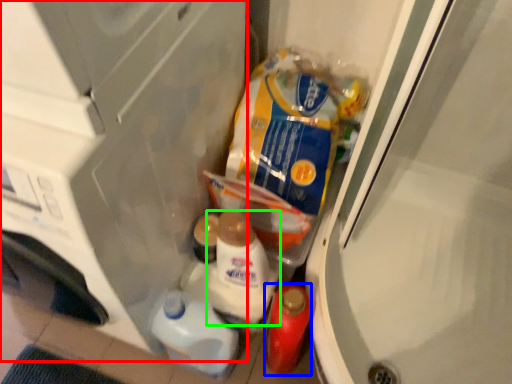
Question: Which object is positioned closest to appliance (highlighted by a red box)? Select from bottle (highlighted by a blue box) and snack (highlighted by a green box).

Choices:
 (A) bottle
 (B) snack

Answer: (B)